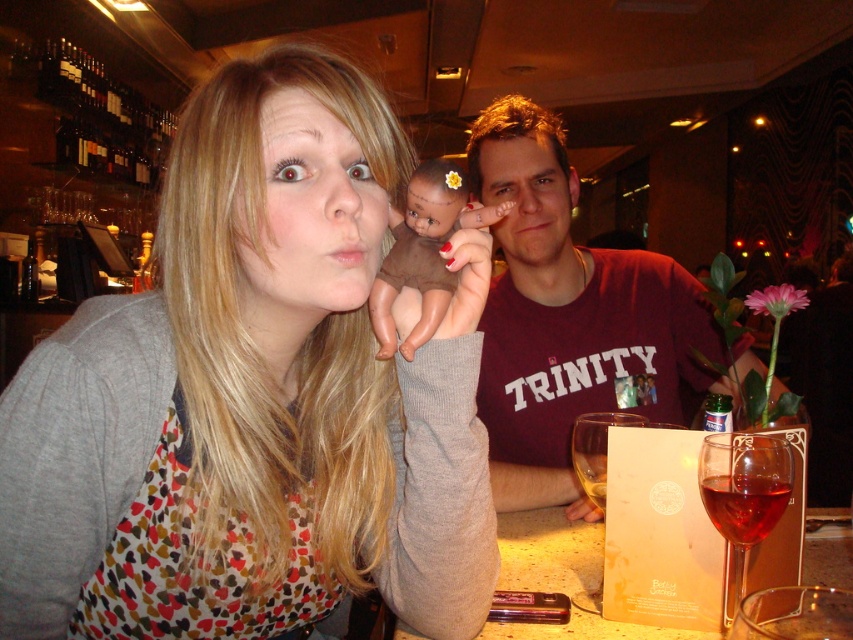
Consider the image. You are standing at the point marked as point (584, 474) in the image. You want to reach the door located at the back of the restaurant without moving your feet. Can you turn your head to see the door?

The point marked as point (584, 474) is 37.79 inches away from the viewer. Since you are at that point, you can turn your head to see the door located at the back of the restaurant without moving your feet.

You are a photographer trying to capture a closeup of the brown matte baby doll at center and the red glass wine at lower right. Which object should you focus on first to ensure it appears sharp in the photo?

The brown matte baby doll at center is closer to the viewer than the red glass wine at lower right, so you should focus on the brown matte baby doll at center first to ensure it appears sharp in the photo.

You are a bartender preparing drinks for a customer. You have a translucent glass at center and a red glass wine at lower right. Which glass should you choose if you need to serve a larger portion of liquid?

The translucent glass at center should be chosen because it has a larger size compared to the red glass wine at lower right, allowing it to hold more liquid.